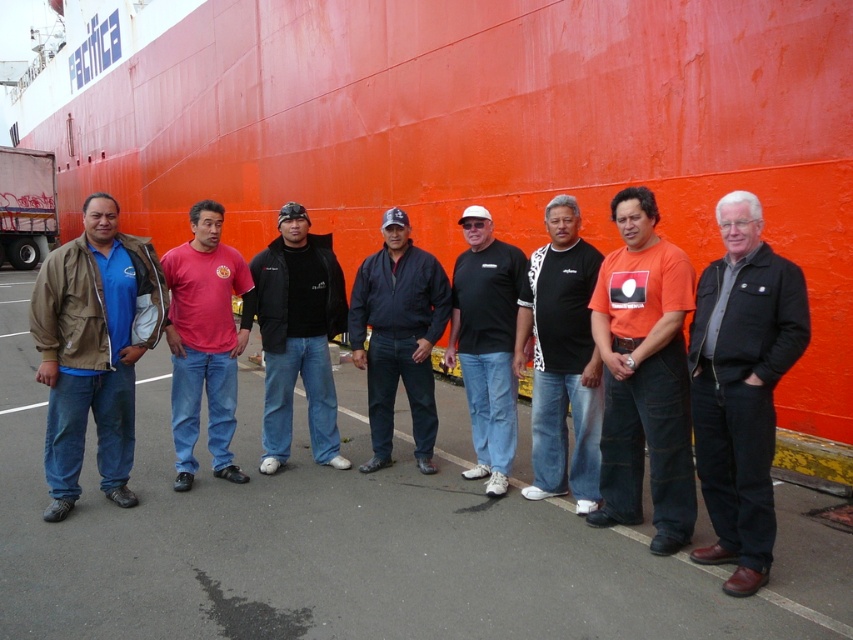
Question: Estimate the real-world distances between objects in this image. Which object is farther from the matte brown jacket at left?

Choices:
 (A) black matte shirt at center
 (B) black matte jacket at center
 (C) white matte trailer truck at left

Answer: (C)

Question: Is black leather jacket at right to the right of white matte trailer truck at left from the viewer's perspective?

Choices:
 (A) yes
 (B) no

Answer: (A)

Question: Is black matte jacket at center below black matte shirt at center?

Choices:
 (A) yes
 (B) no

Answer: (B)

Question: Based on their relative distances, which object is nearer to the black leather jacket at right?

Choices:
 (A) matte pink t-shirt at center
 (B) black matte shirt at center
 (C) matte brown jacket at left

Answer: (B)

Question: Can you confirm if dark blue jacket at center is positioned below white matte trailer truck at left?

Choices:
 (A) yes
 (B) no

Answer: (A)

Question: Estimate the real-world distances between objects in this image. Which object is closer to the white matte trailer truck at left?

Choices:
 (A) black matte jacket at center
 (B) black matte shirt at center
 (C) matte pink t-shirt at center

Answer: (C)